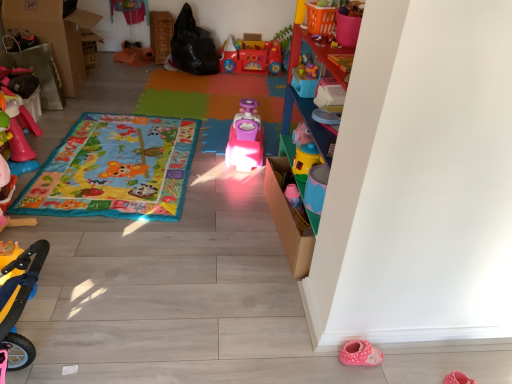
Find the location of a particular element. The height and width of the screenshot is (384, 512). empty space that is to the right of yellow plastic scooter at lower left, acting as the eighth toy starting from the back is located at coordinates (68, 308).